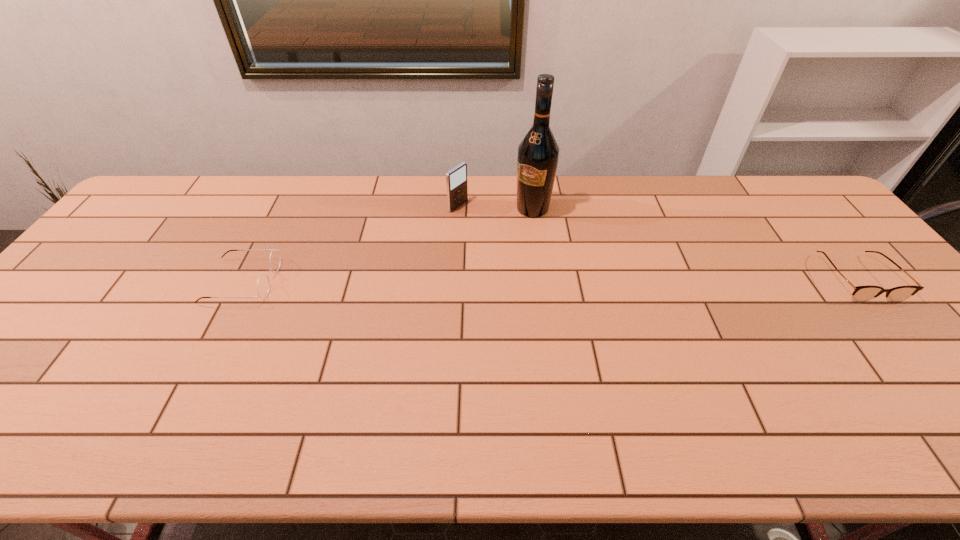
Locate an element on the screen. The image size is (960, 540). vacant space at the far right corner is located at coordinates (820, 207).

Locate an element on the screen. The height and width of the screenshot is (540, 960). vacant space at the near right corner of the desktop is located at coordinates (953, 369).

You are a GUI agent. You are given a task and a screenshot of the screen. Output one action in this format:
    pyautogui.click(x=<x>, y=<y>)
    Task: Click on the vacant space in between the tallest object and the leftmost object
    The width and height of the screenshot is (960, 540).
    Given the screenshot: What is the action you would take?
    pyautogui.click(x=388, y=245)

At what (x,y) coordinates should I click in order to perform the action: click on empty space that is in between the second tallest object and the right spectacles. Please return your answer as a coordinate pair (x, y). Looking at the image, I should click on (657, 242).

This screenshot has height=540, width=960. Find the location of `vacant space that's between the left spectacles and the wine bottle`. vacant space that's between the left spectacles and the wine bottle is located at coordinates (388, 245).

The image size is (960, 540). I want to click on free space that is in between the second tallest object and the rightmost object, so click(x=657, y=242).

At what (x,y) coordinates should I click in order to perform the action: click on empty space between the iPod and the second object from right to left. Please return your answer as a coordinate pair (x, y). The height and width of the screenshot is (540, 960). Looking at the image, I should click on tap(495, 207).

At what (x,y) coordinates should I click in order to perform the action: click on vacant space that is in between the left spectacles and the right spectacles. Please return your answer as a coordinate pair (x, y). The image size is (960, 540). Looking at the image, I should click on (549, 279).

Where is `empty space between the leftmost object and the right spectacles`? empty space between the leftmost object and the right spectacles is located at coordinates (549, 279).

This screenshot has width=960, height=540. In order to click on free spot between the second tallest object and the third object from left to right in this screenshot , I will do `click(495, 207)`.